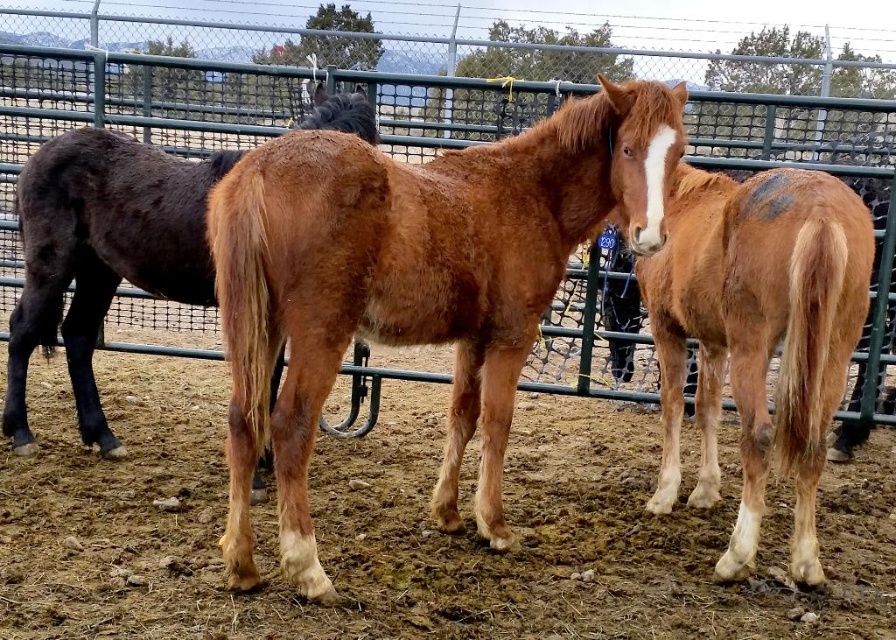
You are standing at the entrance of the fenced enclosure and want to locate the brown soil at center. Based on the coordinates provided, where should you look relative to the entrance?

The brown soil at center is located at coordinates point (411, 529), which means it is positioned towards the right and slightly forward from the entrance.

You are standing at the origin point in the image, which is at the bottom left corner. There are two points marked in the image, point [880,589] and point [423,266]. Which point is further away from you?

Point [880,589] is further away from you because it is behind point [423,266].

You are standing at the entrance of the fenced enclosure and see two points marked in the image. Which point, point (863,563) or point (590,70), is closer to you?

Point (863,563) is closer to you because it is in front of point (590,70).